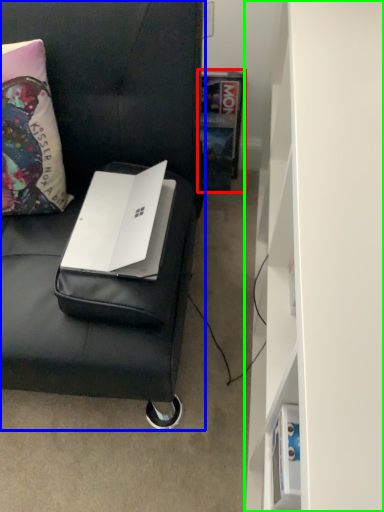
Question: Estimate the real-world distances between objects in this image. Which object is farther from book (highlighted by a red box), furniture (highlighted by a blue box) or bookshelf (highlighted by a green box)?

Choices:
 (A) furniture
 (B) bookshelf

Answer: (B)